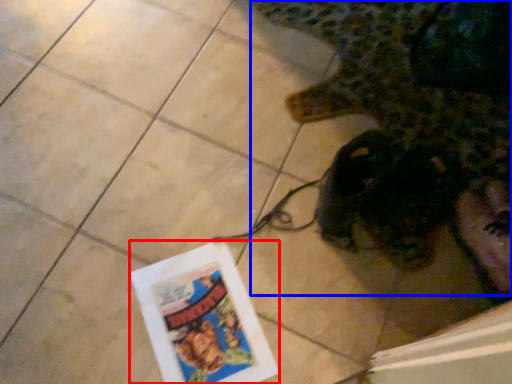
Question: Among these objects, which one is farthest to the camera, flyer (highlighted by a red box) or animal (highlighted by a blue box)?

Choices:
 (A) flyer
 (B) animal

Answer: (A)